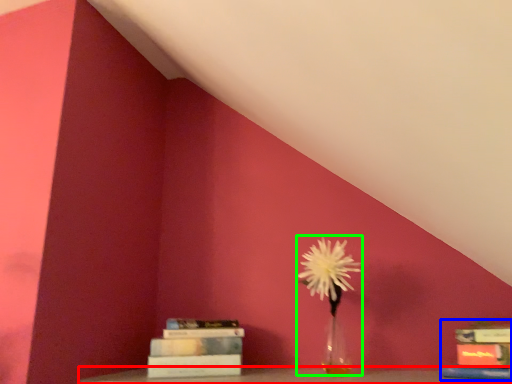
Question: Which is nearer to the furniture (highlighted by a red box)? book (highlighted by a blue box) or floral arrangement (highlighted by a green box).

Choices:
 (A) book
 (B) floral arrangement

Answer: (A)